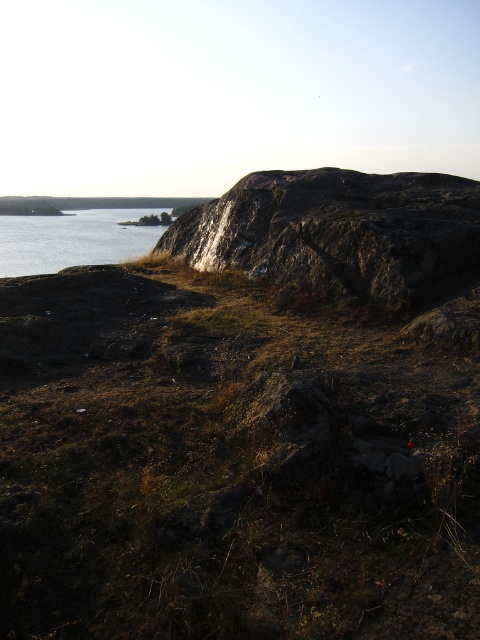
Is rough granite rock at upper right to the left of blue water at left from the viewer's perspective?

Incorrect, rough granite rock at upper right is not on the left side of blue water at left.

Describe the element at coordinates (338, 232) in the screenshot. I see `rough granite rock at upper right` at that location.

The image size is (480, 640). What do you see at coordinates (338, 232) in the screenshot?
I see `rough granite rock at upper right` at bounding box center [338, 232].

At what (x,y) coordinates should I click in order to perform the action: click on rough granite rock at upper right. Please return your answer as a coordinate pair (x, y). This screenshot has width=480, height=640. Looking at the image, I should click on pos(338,232).